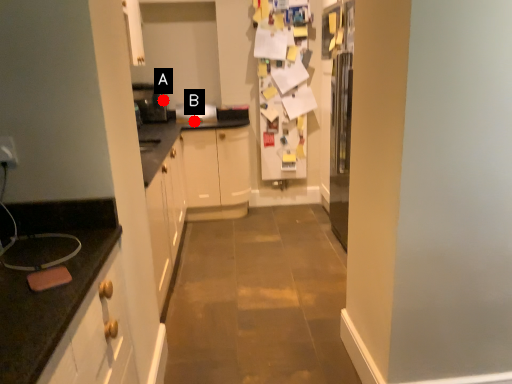
Question: Two points are circled on the image, labeled by A and B beside each circle. Among these points, which one is nearest to the camera?

Choices:
 (A) A is closer
 (B) B is closer

Answer: (B)